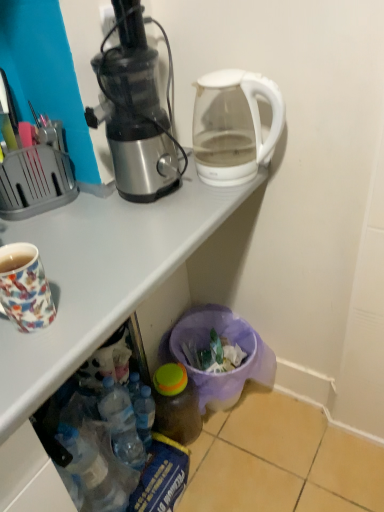
Identify the location of free space in front of metallic silver juicer at left. This screenshot has height=512, width=384. (138, 234).